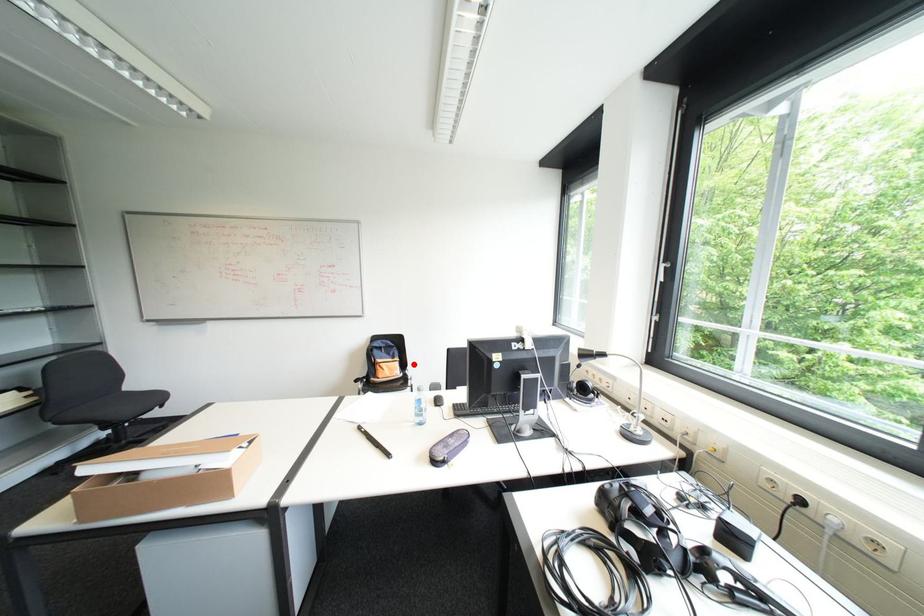
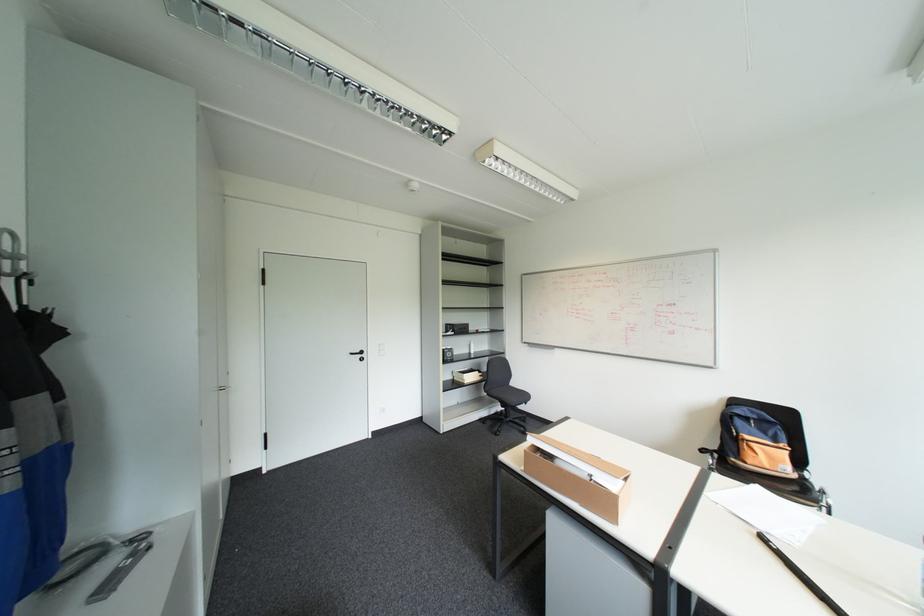
In the second image, find the point that corresponds to the highlighted location in the first image.

(808, 460)